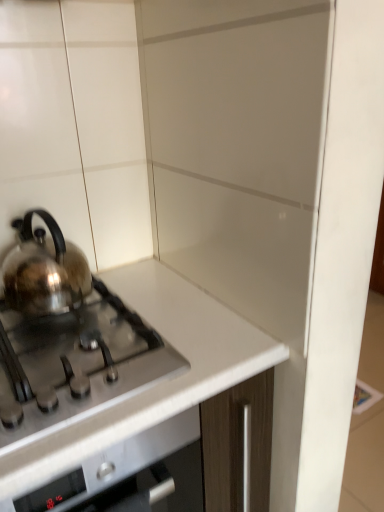
Locate an element on the screen. free space above white glossy countertop at center (from a real-world perspective) is located at coordinates (94, 339).